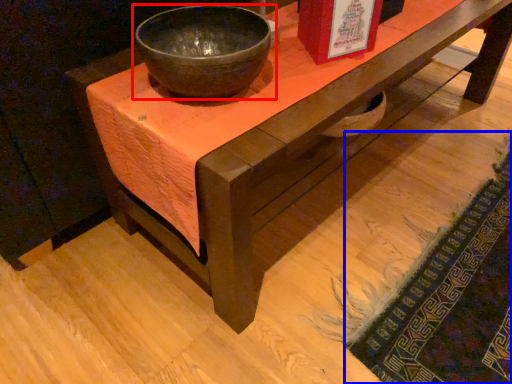
Question: Which point is further to the camera, bowl (highlighted by a red box) or mat (highlighted by a blue box)?

Choices:
 (A) bowl
 (B) mat

Answer: (B)